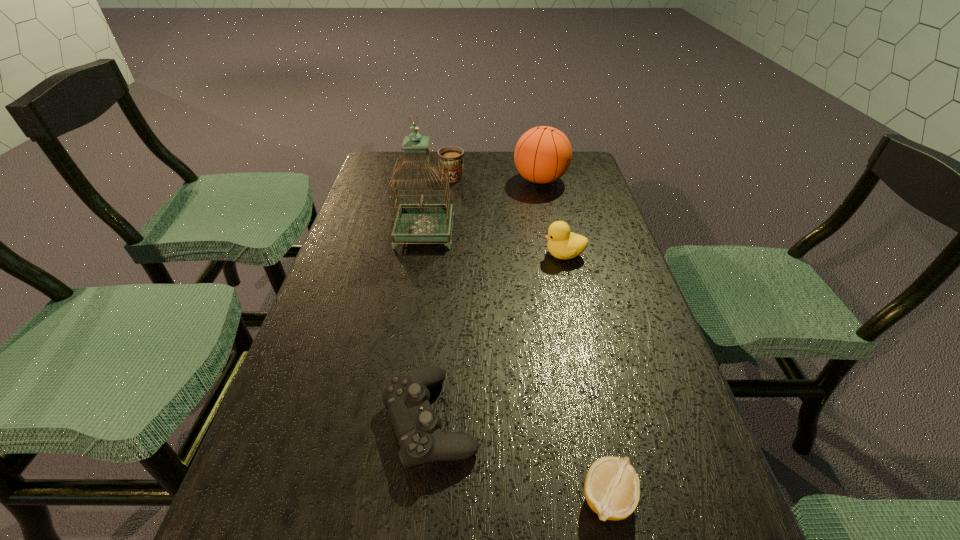
Find the location of a particular element. The width and height of the screenshot is (960, 540). free point between the second shortest object and the mug is located at coordinates (441, 298).

Where is `free space between the mug and the fifth tallest object`? free space between the mug and the fifth tallest object is located at coordinates (x=441, y=298).

Locate an element on the screen. This screenshot has height=540, width=960. vacant area between the duck and the mug is located at coordinates (508, 214).

I want to click on free space that is in between the birdcage and the mug, so click(439, 204).

At what (x,y) coordinates should I click in order to perform the action: click on unoccupied area between the duck and the second shortest object. Please return your answer as a coordinate pair (x, y). The width and height of the screenshot is (960, 540). Looking at the image, I should click on (497, 338).

Identify which object is the closest to the control. Please provide its 2D coordinates. Your answer should be formatted as a tuple, i.e. [(x, y)], where the tuple contains the x and y coordinates of a point satisfying the conditions above.

[(612, 489)]

Point out which object is positioned as the fifth nearest to the tallest object. Please provide its 2D coordinates. Your answer should be formatted as a tuple, i.e. [(x, y)], where the tuple contains the x and y coordinates of a point satisfying the conditions above.

[(612, 489)]

I want to click on vacant position in the image that satisfies the following two spatial constraints: 1. at the door of the tallest object; 2. on the left side of the fifth tallest object, so click(394, 420).

Locate an element on the screen. This screenshot has width=960, height=540. vacant space that satisfies the following two spatial constraints: 1. on the back side of the shortest object; 2. at the door of the birdcage is located at coordinates (552, 232).

I want to click on free space that satisfies the following two spatial constraints: 1. at the door of the tallest object; 2. on the back side of the fifth tallest object, so click(x=394, y=420).